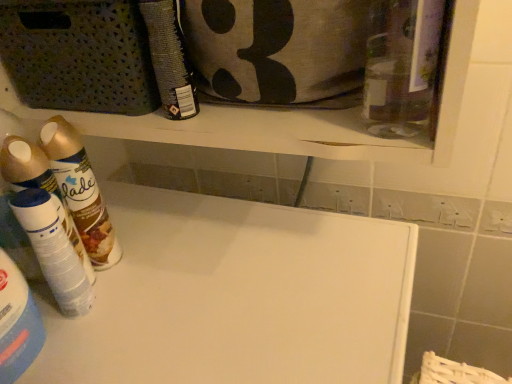
I want to click on free space in front of white plastic spray can at left, positioned as the second cleaning product in left-to-right order, so tap(78, 349).